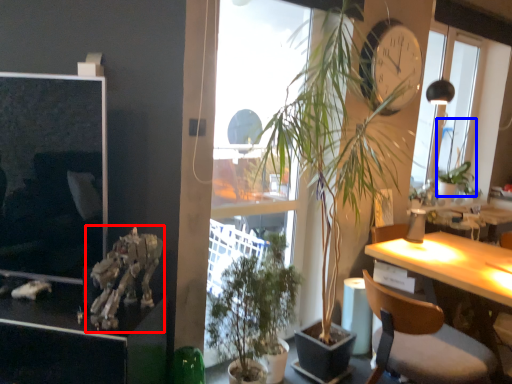
Question: Which of the following is the farthest to the observer, skeleton (highlighted by a red box) or vegetation (highlighted by a blue box)?

Choices:
 (A) skeleton
 (B) vegetation

Answer: (B)